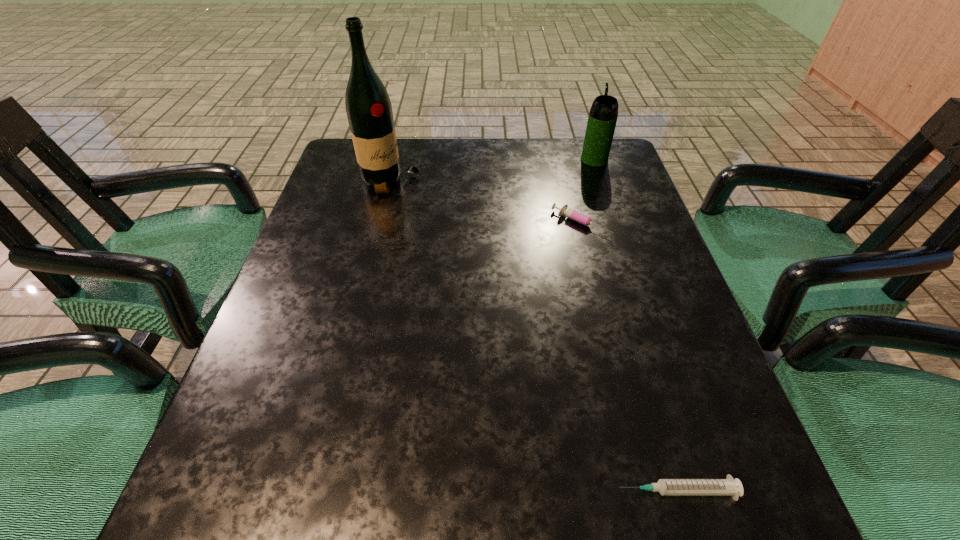
The image size is (960, 540). I want to click on free region at the left edge of the desktop, so click(273, 370).

The width and height of the screenshot is (960, 540). In order to click on vacant region at the right edge of the desktop in this screenshot , I will do `click(616, 284)`.

Image resolution: width=960 pixels, height=540 pixels. I want to click on free spot between the farther syringe and the nearest object, so click(x=629, y=357).

What are the coordinates of `free area in between the farther syringe and the nearest object` in the screenshot? It's located at (629, 357).

I want to click on free space between the wine bottle and the third farthest object, so coord(486,202).

The width and height of the screenshot is (960, 540). In order to click on empty space that is in between the third shortest object and the third farthest object in this screenshot , I will do `click(588, 191)`.

What are the coordinates of `vacant area that lies between the leftmost object and the second nearest object` in the screenshot? It's located at (486, 202).

Locate an element on the screen. The image size is (960, 540). unoccupied position between the second tallest object and the nearest object is located at coordinates (636, 325).

Where is `free point between the nearest object and the wine bottle`? free point between the nearest object and the wine bottle is located at coordinates (534, 336).

Locate an element on the screen. Image resolution: width=960 pixels, height=540 pixels. empty location between the farther syringe and the nearer syringe is located at coordinates (629, 357).